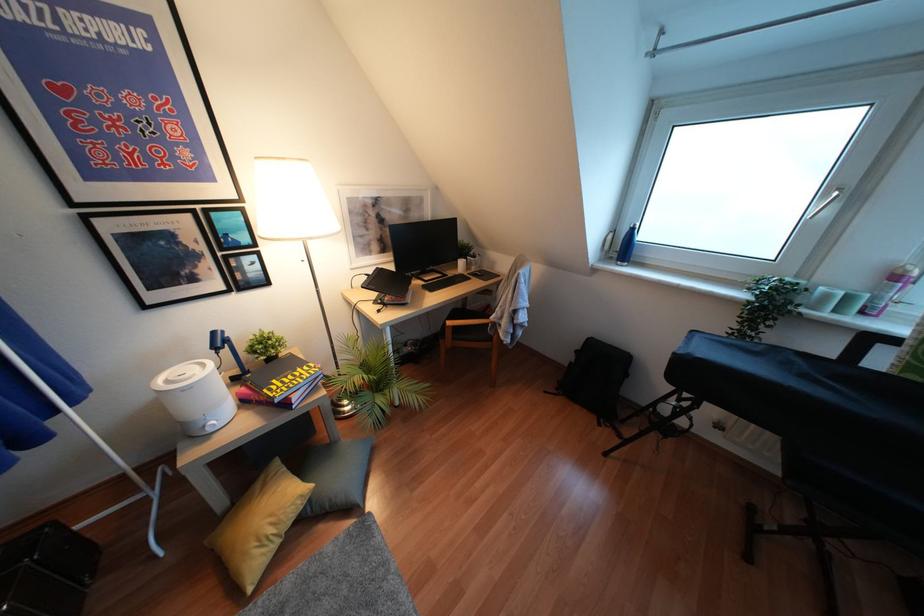
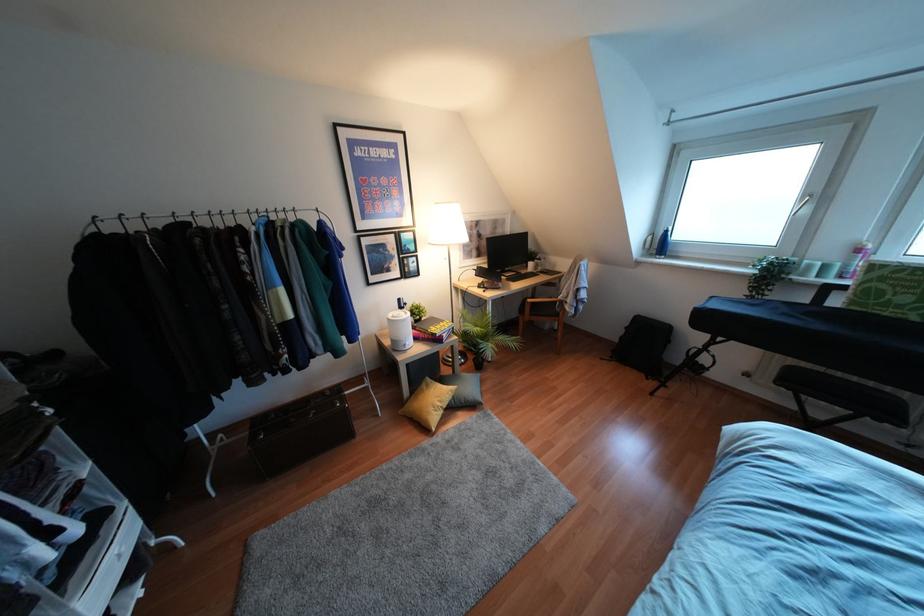
Locate, in the second image, the point that corresponds to (846,298) in the first image.

(824, 267)